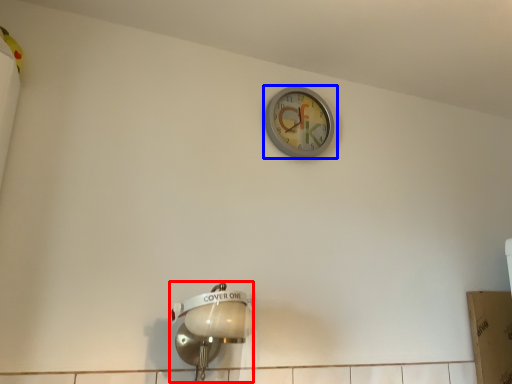
Question: Among these objects, which one is farthest to the camera, light fixture (highlighted by a red box) or wall clock (highlighted by a blue box)?

Choices:
 (A) light fixture
 (B) wall clock

Answer: (B)